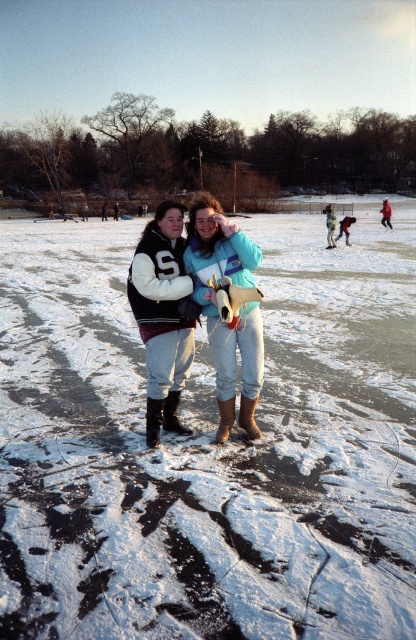
Is white matte snow at center wider than white fleece jacket at center?

Indeed, white matte snow at center has a greater width compared to white fleece jacket at center.

Does white matte snow at center appear on the left side of white fleece jacket at center?

Incorrect, white matte snow at center is not on the left side of white fleece jacket at center.

Between point (358, 276) and point (195, 312), which one is positioned behind?

The point (358, 276) is more distant.

Identify the location of white matte snow at center. (208, 445).

Looking at this image, can you confirm if white matte snow at center is wider than matte blue jacket at center?

Indeed, white matte snow at center has a greater width compared to matte blue jacket at center.

In the scene shown: Can you confirm if white matte snow at center is positioned below matte blue jacket at center?

Incorrect, white matte snow at center is not positioned below matte blue jacket at center.

Is point (406, 218) in front of point (225, 230)?

No, it is not.

At what (x,y) coordinates should I click in order to perform the action: click on white matte snow at center. Please return your answer as a coordinate pair (x, y). Looking at the image, I should click on (208, 445).

Is white fleece jacket at center above matte blue jacket at center?

Actually, white fleece jacket at center is below matte blue jacket at center.

Is white fleece jacket at center to the right of matte blue jacket at center from the viewer's perspective?

In fact, white fleece jacket at center is to the left of matte blue jacket at center.

Is point (151, 380) farther from viewer compared to point (254, 401)?

No, (151, 380) is closer to viewer.

Find the location of a particular element. This screenshot has width=416, height=640. white fleece jacket at center is located at coordinates (163, 316).